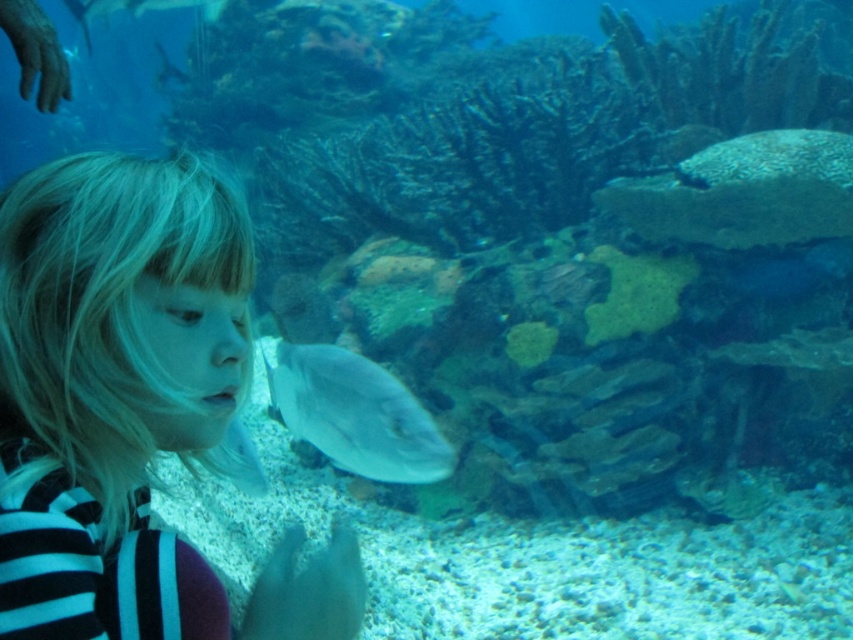
Question: Does blonde hair at left appear under shiny silver fish at center?

Choices:
 (A) no
 (B) yes

Answer: (A)

Question: Among these points, which one is farthest from the camera?

Choices:
 (A) (370, 436)
 (B) (115, 436)

Answer: (A)

Question: Does blonde hair at left appear over shiny silver fish at center?

Choices:
 (A) no
 (B) yes

Answer: (B)

Question: Considering the relative positions of blonde hair at left and shiny silver fish at center in the image provided, where is blonde hair at left located with respect to shiny silver fish at center?

Choices:
 (A) right
 (B) left

Answer: (B)

Question: Which of the following is the farthest from the observer?

Choices:
 (A) shiny silver fish at center
 (B) blonde hair at left

Answer: (A)

Question: Which point is farther from the camera taking this photo?

Choices:
 (A) (345, 465)
 (B) (141, 545)

Answer: (A)